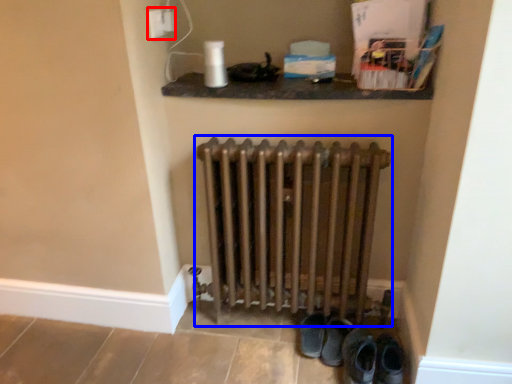
Question: Which point is closer to the camera, electric outlet (highlighted by a red box) or radiator (highlighted by a blue box)?

Choices:
 (A) electric outlet
 (B) radiator

Answer: (B)